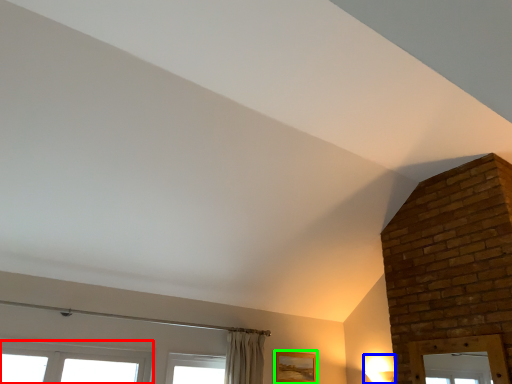
Question: Which object is the farthest from window (highlighted by a red box)? Choose among these: light fixture (highlighted by a blue box) or picture frame (highlighted by a green box).

Choices:
 (A) light fixture
 (B) picture frame

Answer: (A)